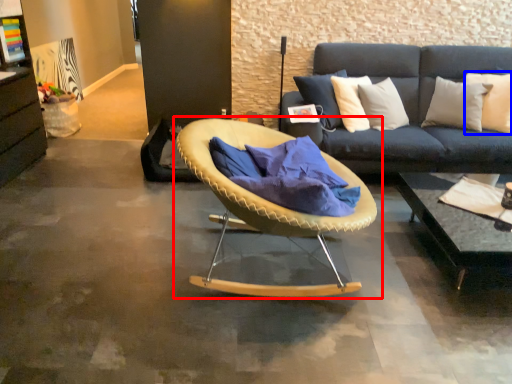
Question: Which object appears closest to the camera in this image, chair (highlighted by a red box) or pillow (highlighted by a blue box)?

Choices:
 (A) chair
 (B) pillow

Answer: (A)